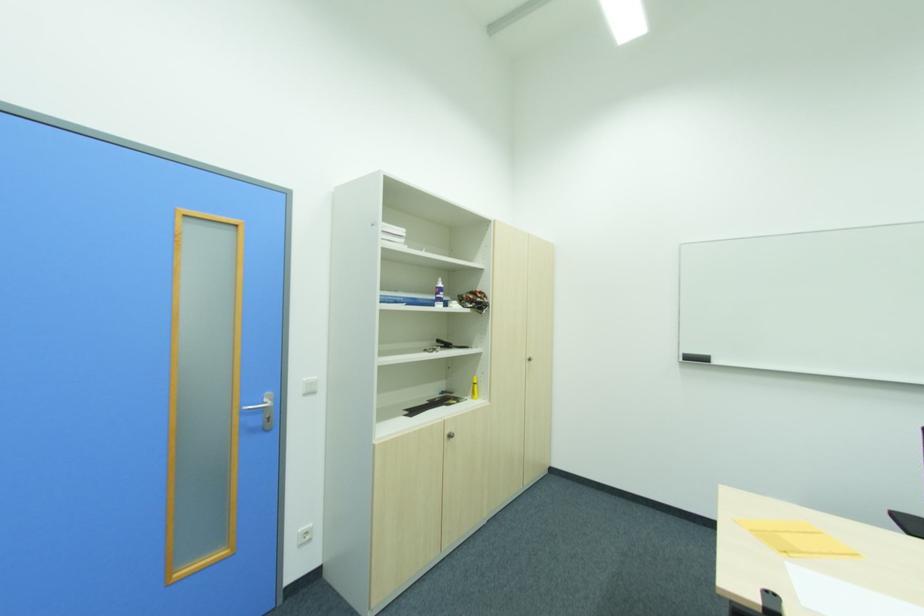
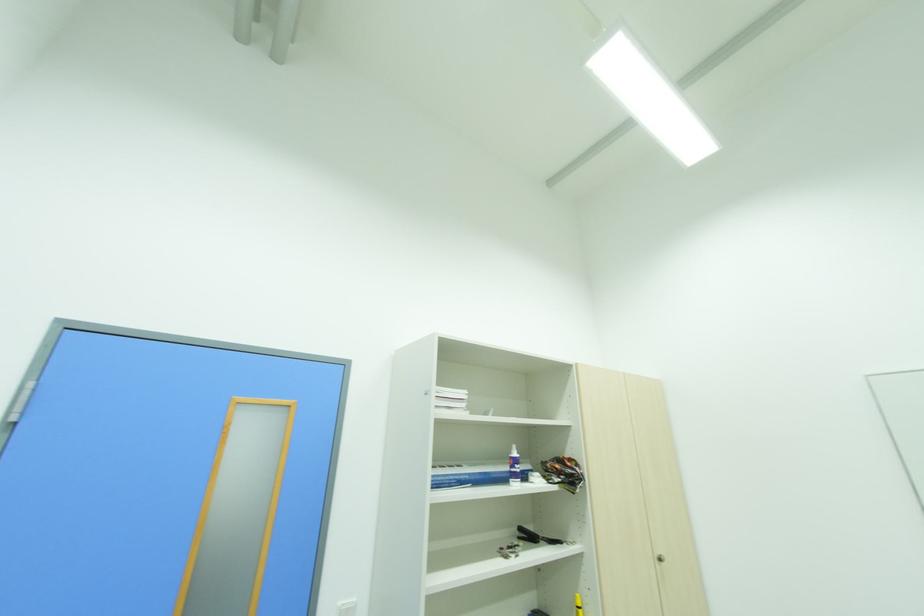
In the second image, find the point that corresponds to (x=444, y=296) in the first image.

(520, 469)